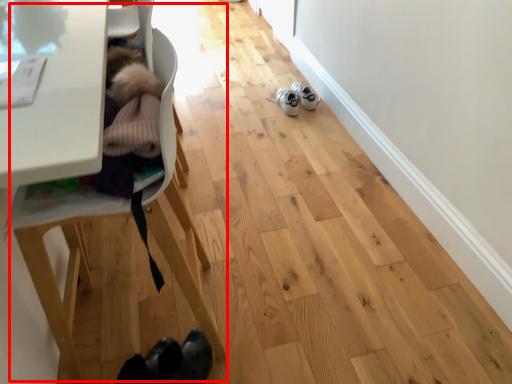
Question: From the image's perspective, considering the relative positions of baby carriage (annotated by the red box) and footwear in the image provided, where is baby carriage (annotated by the red box) located with respect to the staircase?

Choices:
 (A) above
 (B) below

Answer: (B)